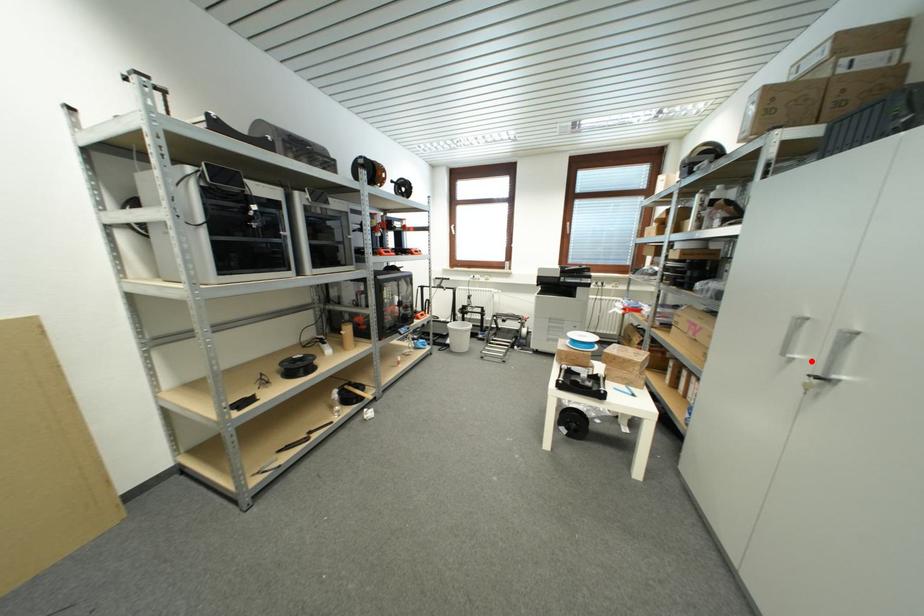
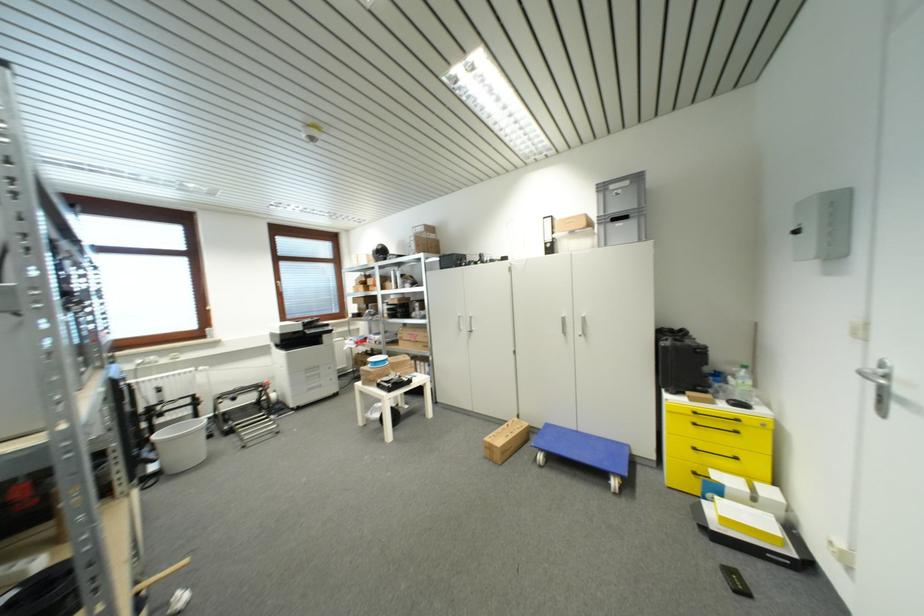
The point at the highlighted location is marked in the first image. Where is the corresponding point in the second image?

(468, 330)